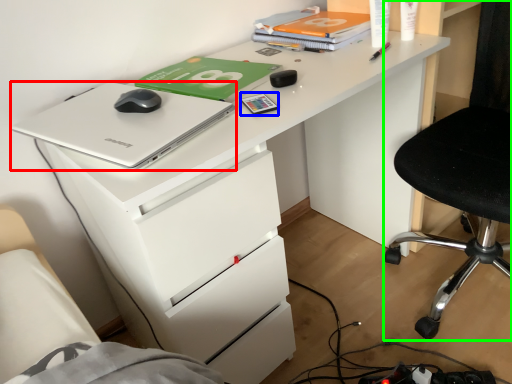
Question: Which is farther away from laptop (highlighted by a red box)? stationery (highlighted by a blue box) or chair (highlighted by a green box)?

Choices:
 (A) stationery
 (B) chair

Answer: (B)